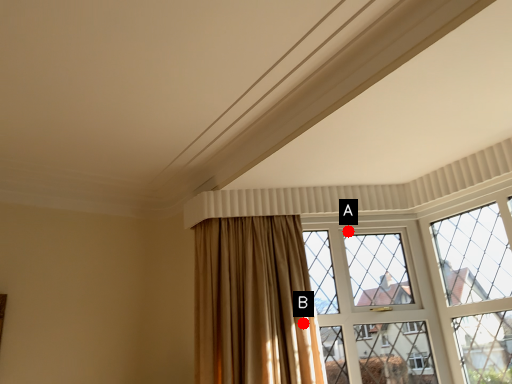
Question: Two points are circled on the image, labeled by A and B beside each circle. Which point is closer to the camera taking this photo?

Choices:
 (A) A is closer
 (B) B is closer

Answer: (B)